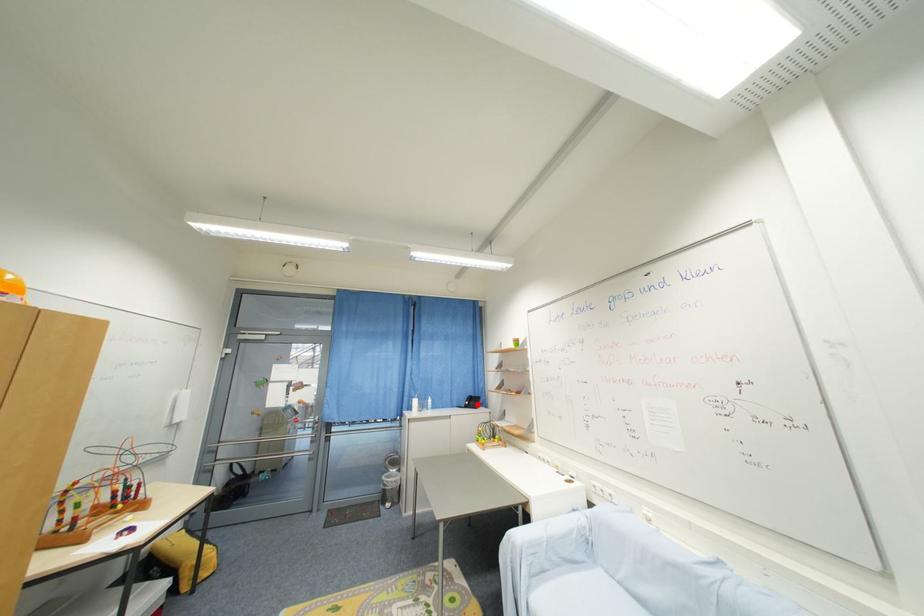
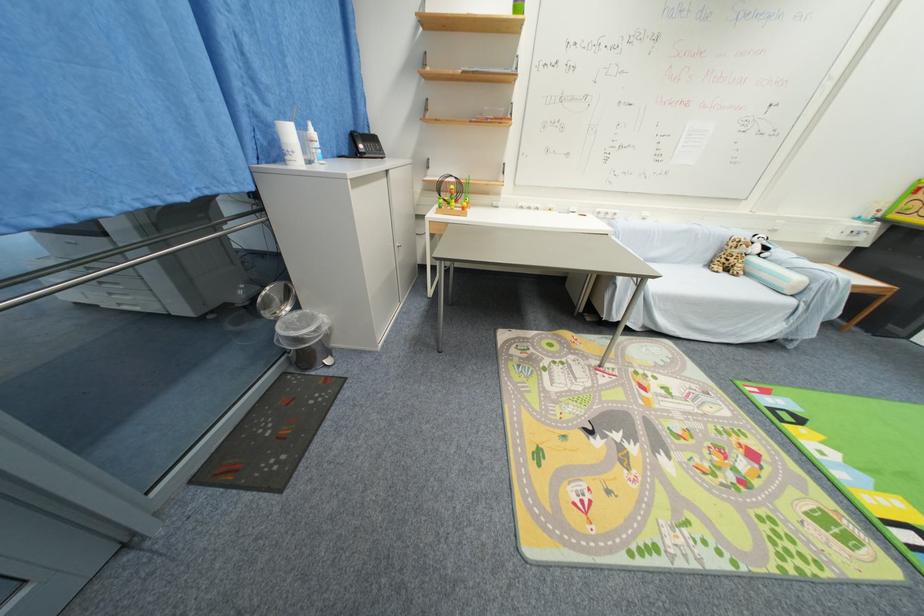
Question: I am providing you with two images of the same scene from different viewpoints. In image1, a red point is highlighted. Considering the same 3D point in image2, which of the following is correct?

Choices:
 (A) It is closer
 (B) It is farther

Answer: (A)